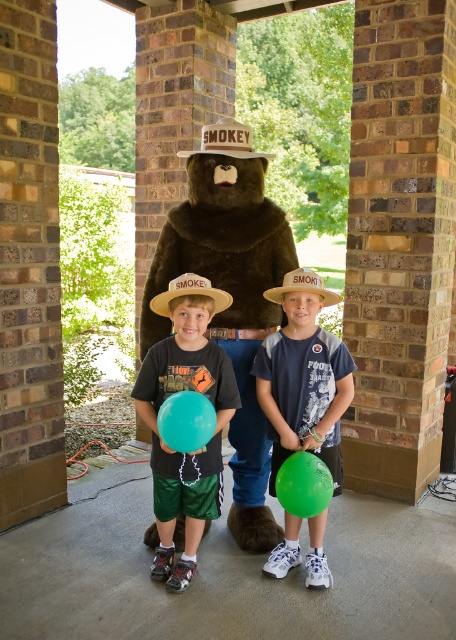
From the picture: You are planning to place a new fire safety sign on the wall behind the brown furry bear at center. The sign must be positioned so that it is directly above the bear. Given the bear is at coordinates point 0.459, 0.507, where should the sign be placed?

The fire safety sign should be placed directly above the brown furry bear at center. Since the bear is located at coordinates point (231, 292), the sign should be positioned at the same x coordinate, 0.459, but higher on the y axis to ensure it is above the bear.

You are a photographer trying to capture a clear photo of the two hats. The brown cardboard cowboy hat at center and the brown straw hat at center. Since the brown cardboard cowboy hat is taller, which hat will appear larger in the photo?

The brown cardboard cowboy hat at center will appear larger in the photo because it is much taller than the brown straw hat at center.

You are a photographer trying to capture a group photo of the brown furry bear at center and the green matte balloon at center. The camera you are using has a maximum focus range of 12 inches. Will you be able to focus on both subjects simultaneously?

The brown furry bear at center is 13.60 inches away from the green matte balloon at center, which is beyond the camera maximum focus range of 12 inches. Therefore, you cannot focus on both subjects simultaneously.